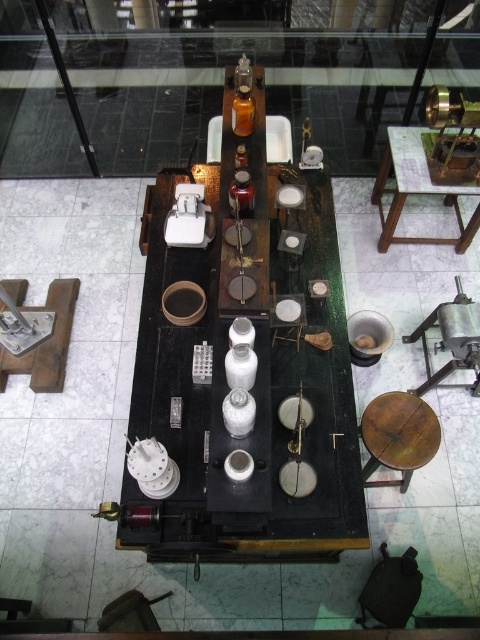
Question: Which is farther from the wooden table at upper right?

Choices:
 (A) wooden stool at lower right
 (B) wooden table at center

Answer: (A)

Question: Is wooden table at upper right positioned behind wooden stool at lower right?

Choices:
 (A) no
 (B) yes

Answer: (B)

Question: Which object is positioned closest to the wooden table at upper right?

Choices:
 (A) wooden table at center
 (B) wooden stool at lower right

Answer: (A)

Question: Is wooden table at center to the right of wooden table at upper right from the viewer's perspective?

Choices:
 (A) no
 (B) yes

Answer: (A)

Question: Among these objects, which one is nearest to the camera?

Choices:
 (A) wooden table at upper right
 (B) wooden table at center
 (C) wooden stool at lower right

Answer: (B)

Question: Is wooden table at center bigger than wooden stool at lower right?

Choices:
 (A) no
 (B) yes

Answer: (B)